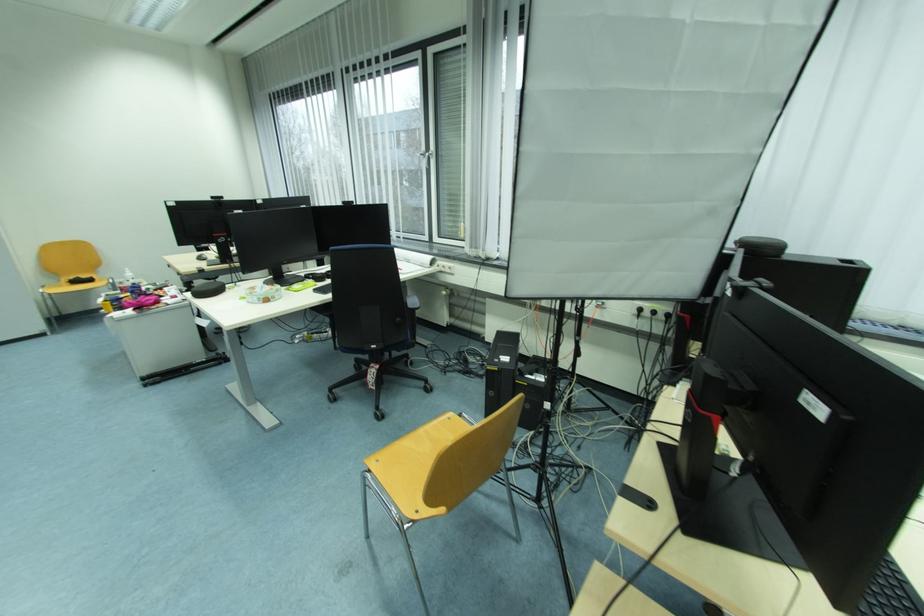
Locate an element on the screen. black chair armrest is located at coordinates (412, 299).